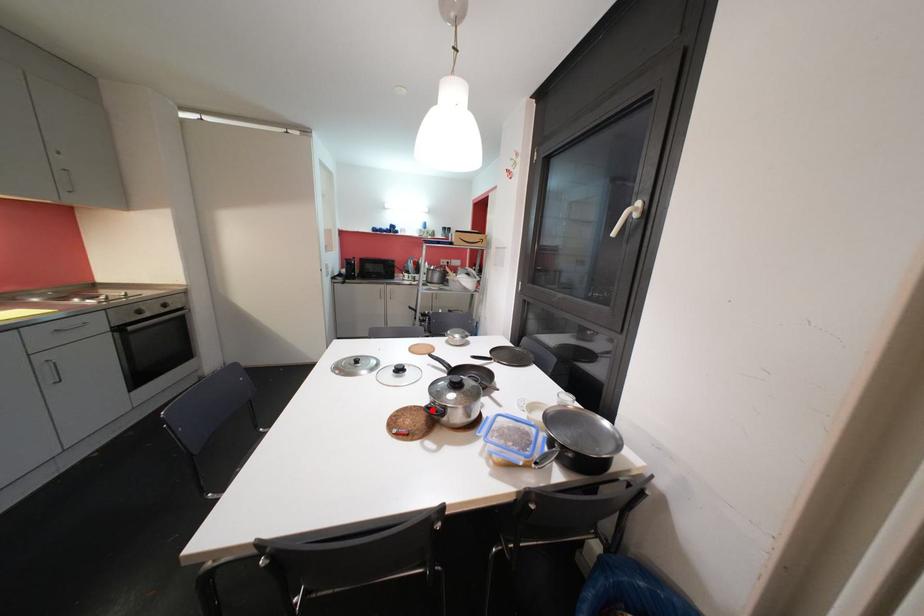
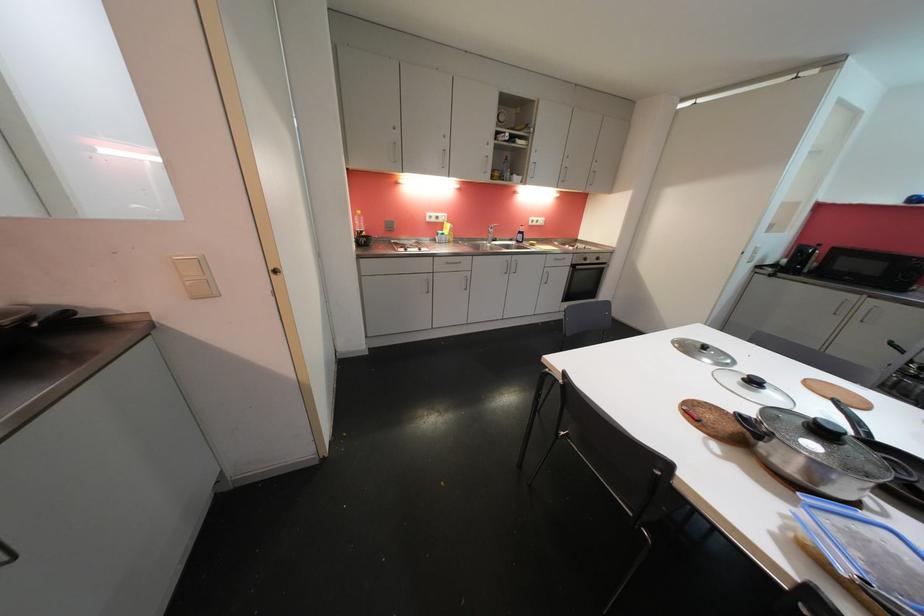
Question: I am providing you with two images of the same scene from different viewpoints. A red point is marked on the first image. At the location where the point appears in image 1, is it still visible in image 2?

Choices:
 (A) Yes
 (B) No

Answer: (A)